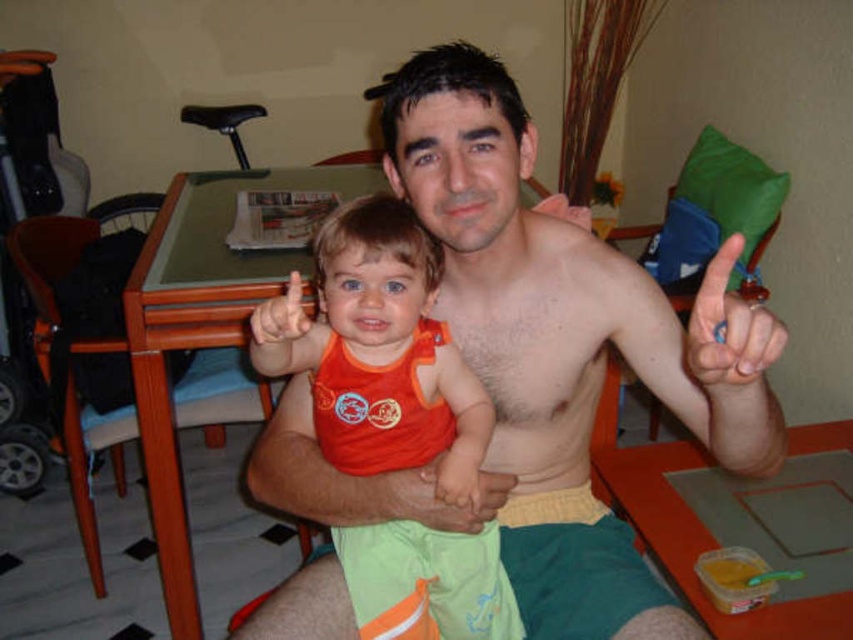
Is orange fabric toddler at center positioned in front of blue rubber band at upper center?

No, orange fabric toddler at center is behind blue rubber band at upper center.

Can you confirm if orange fabric toddler at center is thinner than blue rubber band at upper center?

In fact, orange fabric toddler at center might be wider than blue rubber band at upper center.

Locate an element on the screen. The width and height of the screenshot is (853, 640). orange fabric toddler at center is located at coordinates (378, 349).

Does shiny orange tank top at center come behind orange fabric toddler at center?

No.

From the picture: Can you confirm if shiny orange tank top at center is thinner than orange fabric toddler at center?

In fact, shiny orange tank top at center might be wider than orange fabric toddler at center.

Locate an element on the screen. shiny orange tank top at center is located at coordinates (566, 346).

Is shiny orange tank top at center smaller than blue rubber band at upper center?

Actually, shiny orange tank top at center might be larger than blue rubber band at upper center.

Is point (560, 547) farther from camera compared to point (769, 332)?

Yes, it is.

You are a GUI agent. You are given a task and a screenshot of the screen. Output one action in this format:
    pyautogui.click(x=<x>, y=<y>)
    Task: Click on the shiny orange tank top at center
    Image resolution: width=853 pixels, height=640 pixels.
    Given the screenshot: What is the action you would take?
    pyautogui.click(x=566, y=346)